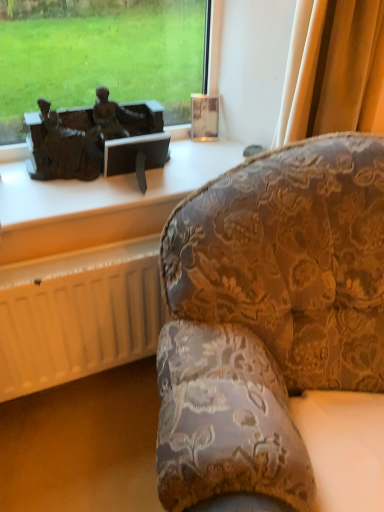
Question: In terms of width, does white matte radiator at lower left look wider or thinner when compared to matte bronze sculpture at upper left?

Choices:
 (A) thin
 (B) wide

Answer: (A)

Question: Is white matte radiator at lower left taller or shorter than matte bronze sculpture at upper left?

Choices:
 (A) short
 (B) tall

Answer: (B)

Question: Estimate the real-world distances between objects in this image. Which object is closer to the bronze statue at left?

Choices:
 (A) matte bronze sculpture at upper left
 (B) white matte radiator at lower left
 (C) velvet floral-patterned couch at right

Answer: (A)

Question: Which is nearer to the velvet floral-patterned couch at right?

Choices:
 (A) bronze statue at left
 (B) white matte radiator at lower left
 (C) matte bronze sculpture at upper left

Answer: (B)